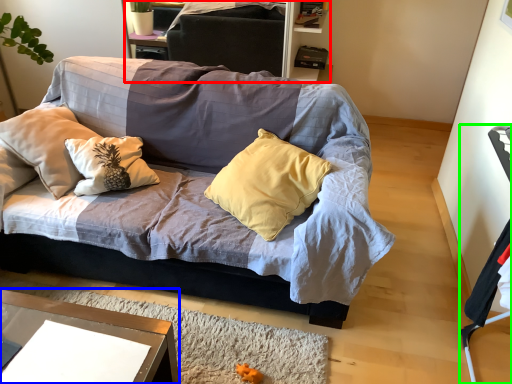
Question: Which is nearer to the dresser (highlighted by a red box)? desk (highlighted by a blue box) or armchair (highlighted by a green box).

Choices:
 (A) desk
 (B) armchair

Answer: (A)